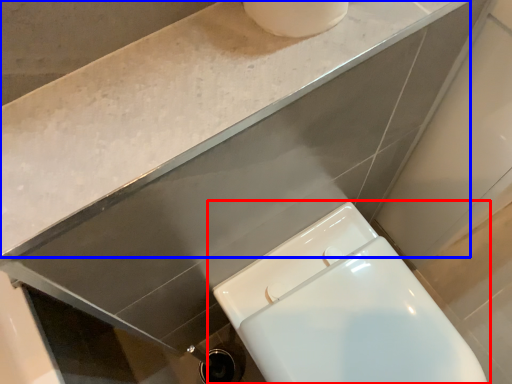
Question: Which object appears farthest to the camera in this image, toilet (highlighted by a red box) or counter top (highlighted by a blue box)?

Choices:
 (A) toilet
 (B) counter top

Answer: (A)